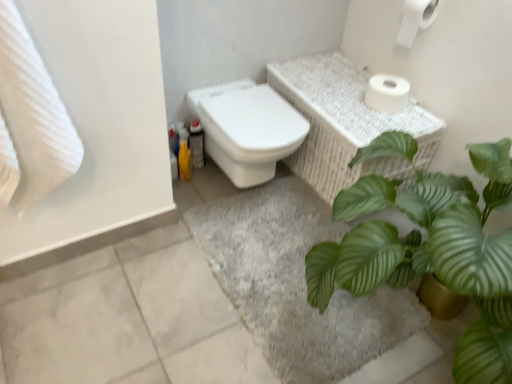
The width and height of the screenshot is (512, 384). I want to click on vacant area on top of white matte toilet paper at upper right, the 2th toilet paper when ordered from top to bottom (from a real-world perspective), so click(390, 83).